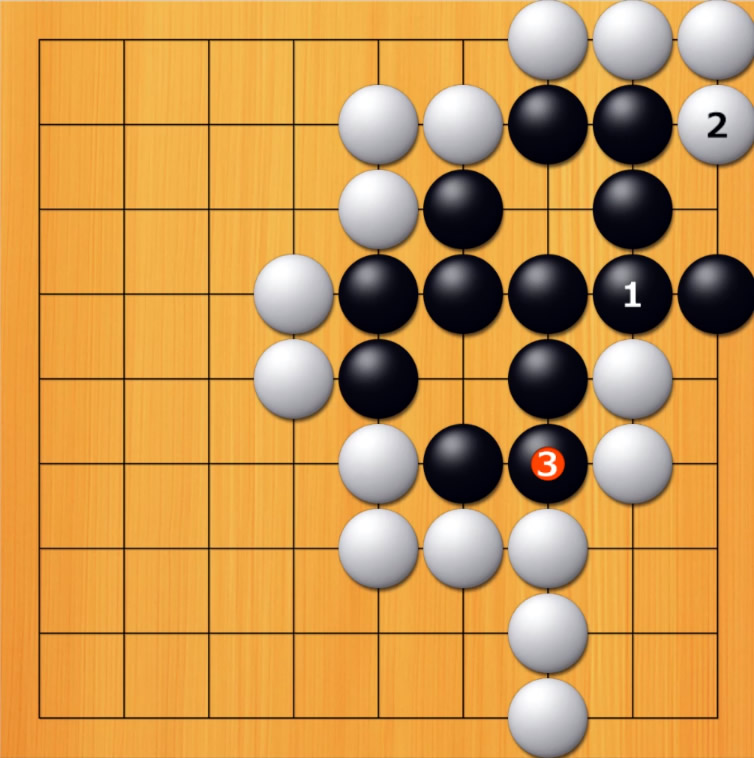
The width and height of the screenshot is (754, 758). Find the location of `columns`. columns is located at coordinates (121, 713), (207, 716), (293, 713), (379, 716), (460, 716), (630, 713), (716, 716), (38, 713).